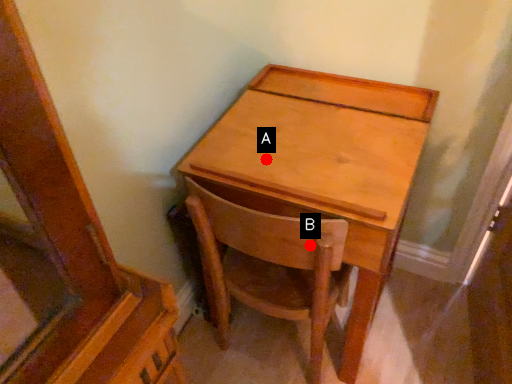
Question: Two points are circled on the image, labeled by A and B beside each circle. Among these points, which one is farthest from the camera?

Choices:
 (A) A is further
 (B) B is further

Answer: (A)